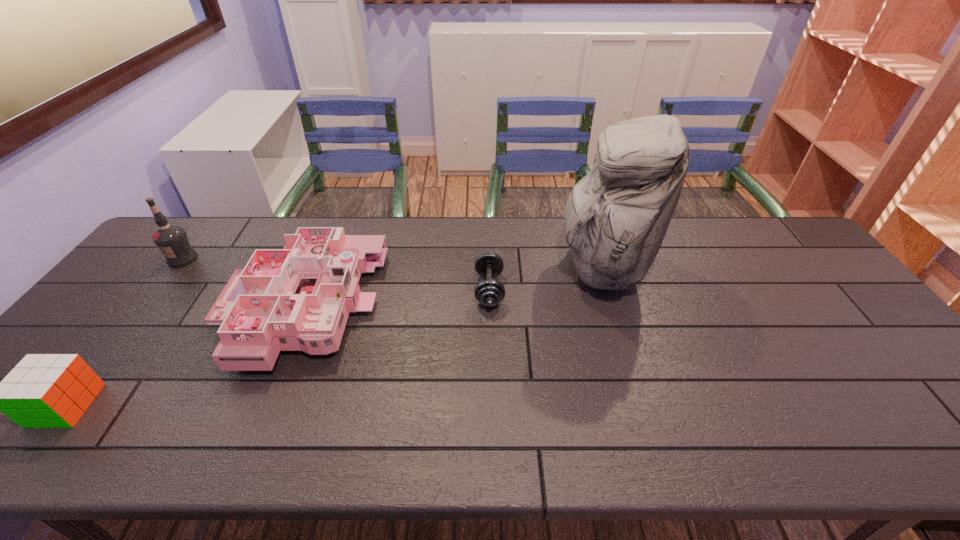
Where is `vacant area between the third object from right to left and the cube`? This screenshot has height=540, width=960. vacant area between the third object from right to left and the cube is located at coordinates (183, 356).

I want to click on free space between the dollhouse and the tallest object, so click(x=451, y=288).

Identify the location of empty location between the nearest object and the dollhouse. This screenshot has width=960, height=540. (183, 356).

Identify the location of unoccupied area between the rightmost object and the dollhouse. (451, 288).

This screenshot has height=540, width=960. Find the location of `the closest object to the backpack`. the closest object to the backpack is located at coordinates (489, 292).

Identify which object is the fourth closest to the dollhouse. Please provide its 2D coordinates. Your answer should be formatted as a tuple, i.e. [(x, y)], where the tuple contains the x and y coordinates of a point satisfying the conditions above.

[(615, 219)]

Where is `vacant space that satisfies the following two spatial constraints: 1. on the front-facing side of the tallest object; 2. on the front side of the dumbbell`? The image size is (960, 540). vacant space that satisfies the following two spatial constraints: 1. on the front-facing side of the tallest object; 2. on the front side of the dumbbell is located at coordinates (608, 289).

This screenshot has height=540, width=960. Identify the location of free spot that satisfies the following two spatial constraints: 1. on the front-facing side of the backpack; 2. on the front side of the shortest object. (608, 289).

This screenshot has width=960, height=540. In order to click on free space in the image that satisfies the following two spatial constraints: 1. on the front side of the shortest object; 2. at the front entrance of the third object from left to right in this screenshot , I will do `click(490, 307)`.

Locate an element on the screen. The height and width of the screenshot is (540, 960). free space that satisfies the following two spatial constraints: 1. on the front-facing side of the rightmost object; 2. on the front side of the dumbbell is located at coordinates (608, 289).